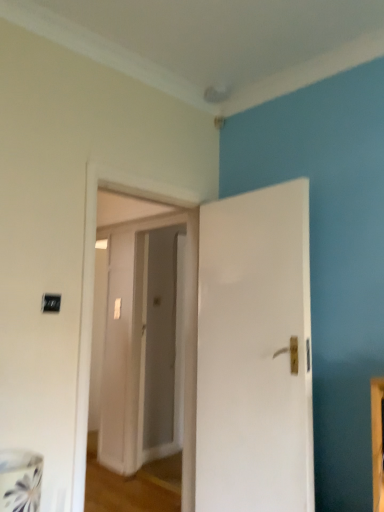
What is the approximate height of white wooden door at center?

The height of white wooden door at center is 6.80 feet.

The image size is (384, 512). I want to click on white wooden door at center, so click(x=144, y=339).

This screenshot has width=384, height=512. What do you see at coordinates (144, 339) in the screenshot?
I see `white wooden door at center` at bounding box center [144, 339].

Consider the image. In order to face white wooden door at center, should I rotate leftwards or rightwards?

You should rotate left by 5.323 degrees.

Where is `white wooden door at center`? white wooden door at center is located at coordinates (144, 339).